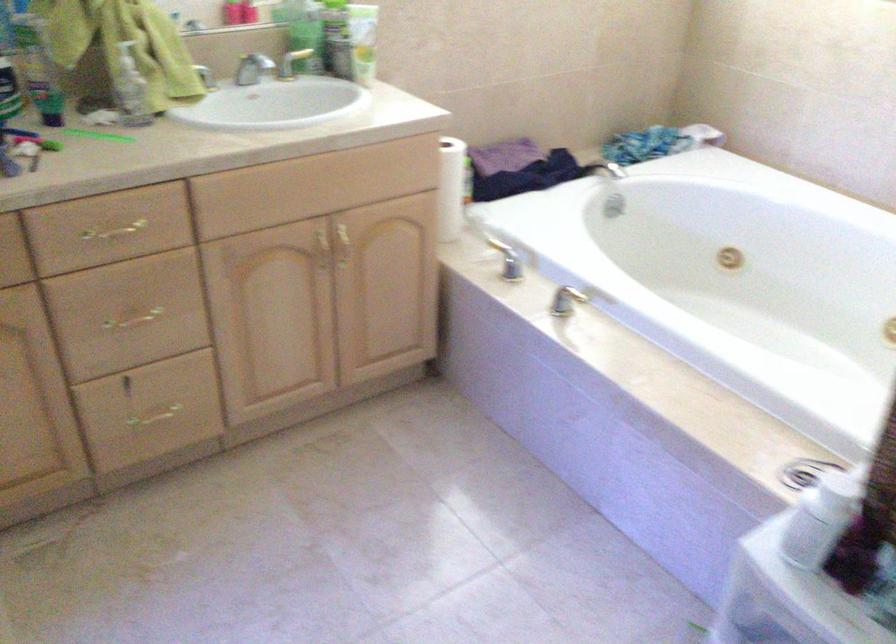
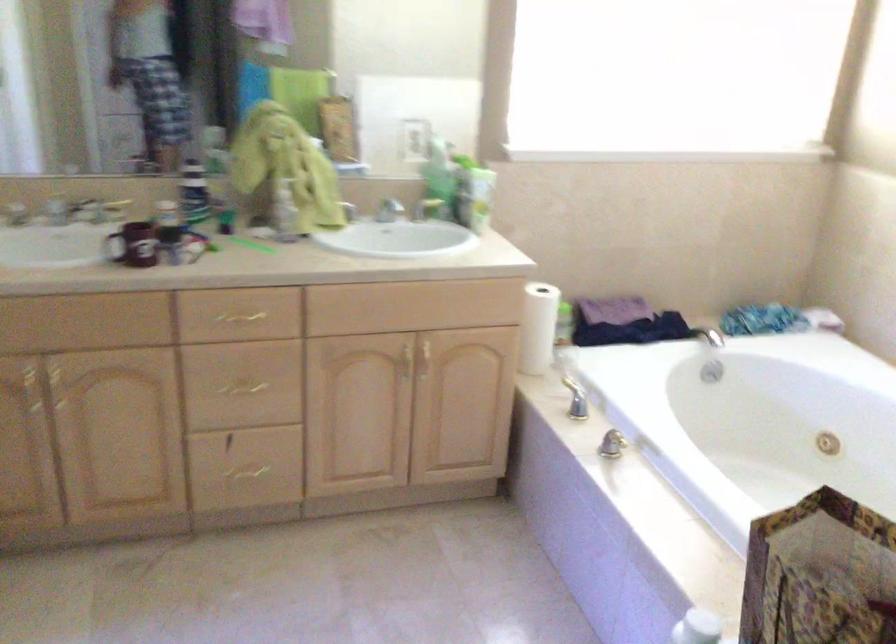
Question: The first image is from the beginning of the video and the second image is from the end. How did the camera likely rotate when shooting the video?

Choices:
 (A) Left
 (B) Right
 (C) Up
 (D) Down

Answer: (A)